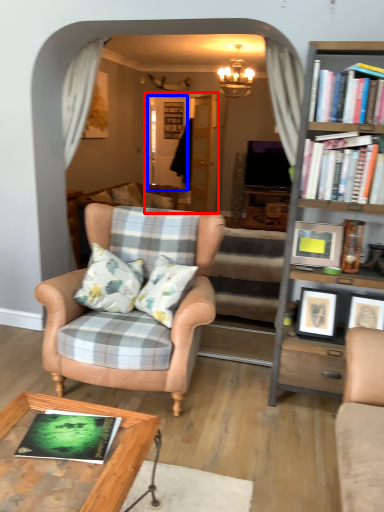
Question: Which point is further to the camera, glass door (highlighted by a red box) or glass door (highlighted by a blue box)?

Choices:
 (A) glass door
 (B) glass door

Answer: (B)